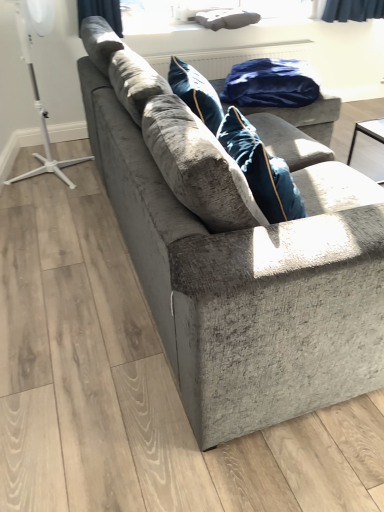
Find the location of a particular element. free spot in front of white plastic tripod at left is located at coordinates (45, 199).